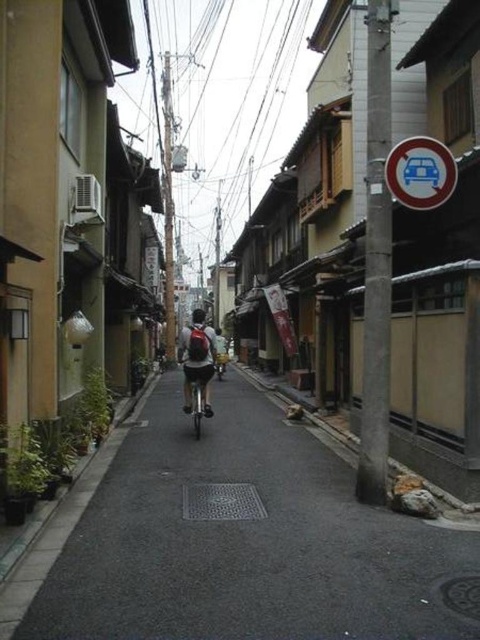
You are a delivery person carrying a package and need to place it on the shiny metallic bicycle at center. However, there is a matte black backpack at center in the way. Can you place the package on the bicycle without moving the backpack?

The matte black backpack at center is positioned over the shiny metallic bicycle at center, so you cannot place the package on the bicycle without moving the backpack.

You are a delivery person who needs to choose a bicycle to carry heavy packages. Both the metallic silver bicycle at center and the shiny metallic bicycle at center are available. Which bicycle should you choose based on their heights?

The metallic silver bicycle at center is shorter than the shiny metallic bicycle at center. Since shorter bicycles typically have lower frames, they are easier to mount and dismount with heavy packages, so you should choose the metallic silver bicycle at center.

You are standing at the entrance of the street and want to take a photo that includes both point (206, 378) and point (227, 355). Which point should you focus on first to ensure both are in focus?

You should focus on point (206, 378) first because it is closer to the camera than point (227, 355), ensuring both points are within the depth of field.